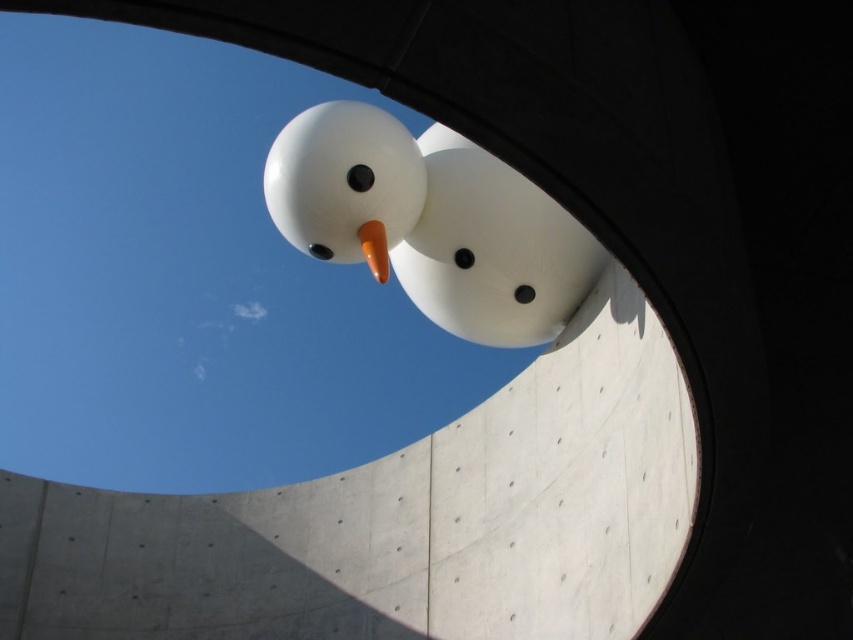
Question: Is smooth concrete at center to the left of white matte snowman at center from the viewer's perspective?

Choices:
 (A) yes
 (B) no

Answer: (A)

Question: Is the position of smooth concrete at center less distant than that of white matte snowman at center?

Choices:
 (A) no
 (B) yes

Answer: (B)

Question: Which point is farther to the camera?

Choices:
 (A) white matte snowman at center
 (B) smooth concrete at center

Answer: (A)

Question: Which of the following is the closest to the observer?

Choices:
 (A) (506, 234)
 (B) (675, 492)

Answer: (B)

Question: Considering the relative positions of smooth concrete at center and white matte snowman at center in the image provided, where is smooth concrete at center located with respect to white matte snowman at center?

Choices:
 (A) below
 (B) above

Answer: (A)